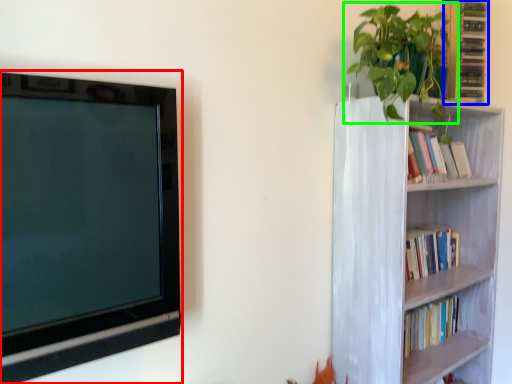
Question: Which object is the farthest from television (highlighted by a red box)? Choose among these: cabinet (highlighted by a blue box) or houseplant (highlighted by a green box).

Choices:
 (A) cabinet
 (B) houseplant

Answer: (A)